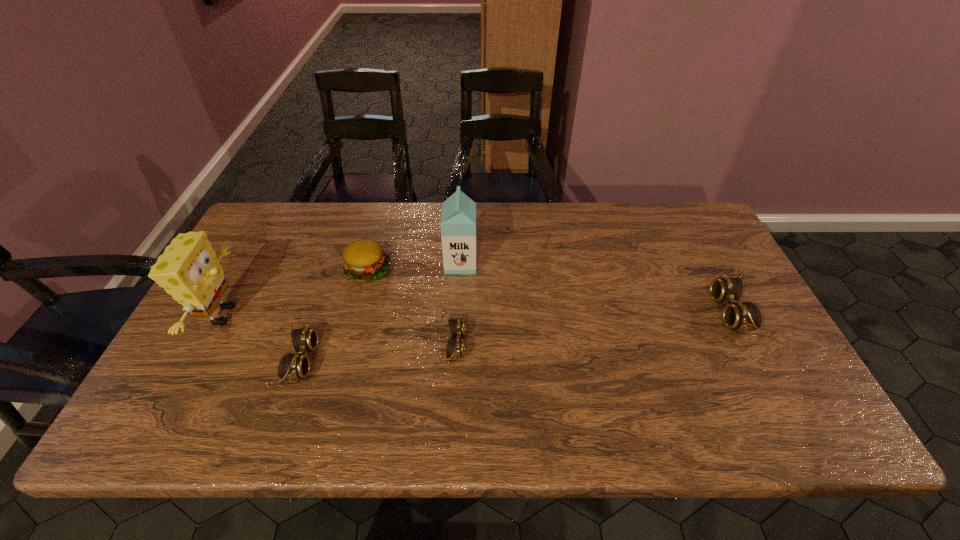
Image resolution: width=960 pixels, height=540 pixels. In order to click on vacant space located through the lenses of the second goggles from left to right in this screenshot , I will do `click(521, 345)`.

This screenshot has height=540, width=960. In order to click on vacant space located 0.320m through the lenses of the rightmost goggles in this screenshot , I will do `click(595, 314)`.

Locate an element on the screen. free space located 0.140m through the lenses of the rightmost goggles is located at coordinates (662, 314).

Find the location of a particular element. The width and height of the screenshot is (960, 540). vacant space situated 0.050m through the lenses of the rightmost goggles is located at coordinates click(x=696, y=314).

This screenshot has width=960, height=540. I want to click on vacant space situated 0.170m on the front of the milk carton, so tap(458, 320).

At what (x,y) coordinates should I click in order to perform the action: click on blank space located on the front of the fourth object from right to left. Please return your answer as a coordinate pair (x, y). The image size is (960, 540). Looking at the image, I should click on coord(339,379).

At what (x,y) coordinates should I click in order to perform the action: click on blank space located on the face of the leftmost object. Please return your answer as a coordinate pair (x, y). The height and width of the screenshot is (540, 960). Looking at the image, I should click on (303, 315).

This screenshot has height=540, width=960. I want to click on object present at the left edge, so click(x=188, y=270).

The height and width of the screenshot is (540, 960). Find the location of `object that is at the right edge`. object that is at the right edge is located at coordinates (746, 316).

Find the location of a particular element. The image size is (960, 540). free point at the far edge is located at coordinates (594, 244).